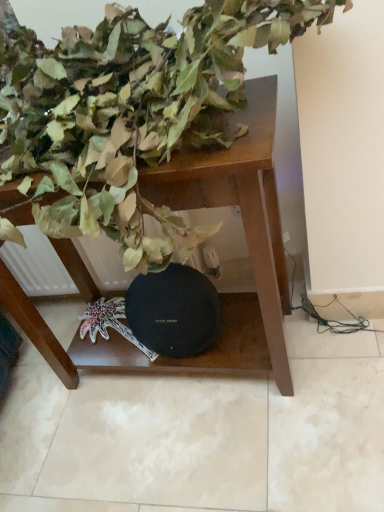
Question: From their relative heights in the image, would you say green matte leaves at upper left is taller or shorter than brown wooden table at center?

Choices:
 (A) tall
 (B) short

Answer: (B)

Question: Considering the positions of green matte leaves at upper left and brown wooden table at center in the image, is green matte leaves at upper left wider or thinner than brown wooden table at center?

Choices:
 (A) thin
 (B) wide

Answer: (B)

Question: From a real-world perspective, is green matte leaves at upper left physically located above or below brown wooden table at center?

Choices:
 (A) above
 (B) below

Answer: (A)

Question: Does point (16, 283) appear closer or farther from the camera than point (122, 122)?

Choices:
 (A) closer
 (B) farther

Answer: (B)

Question: In terms of width, does brown wooden table at center look wider or thinner when compared to green matte leaves at upper left?

Choices:
 (A) thin
 (B) wide

Answer: (A)

Question: In terms of height, does brown wooden table at center look taller or shorter compared to green matte leaves at upper left?

Choices:
 (A) tall
 (B) short

Answer: (A)

Question: From a real-world perspective, is brown wooden table at center above or below green matte leaves at upper left?

Choices:
 (A) above
 (B) below

Answer: (B)